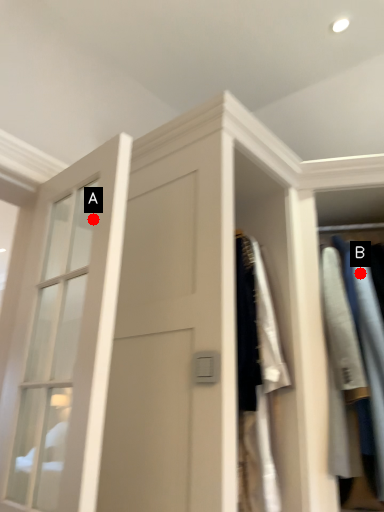
Question: Two points are circled on the image, labeled by A and B beside each circle. Which point appears closest to the camera in this image?

Choices:
 (A) A is closer
 (B) B is closer

Answer: (A)